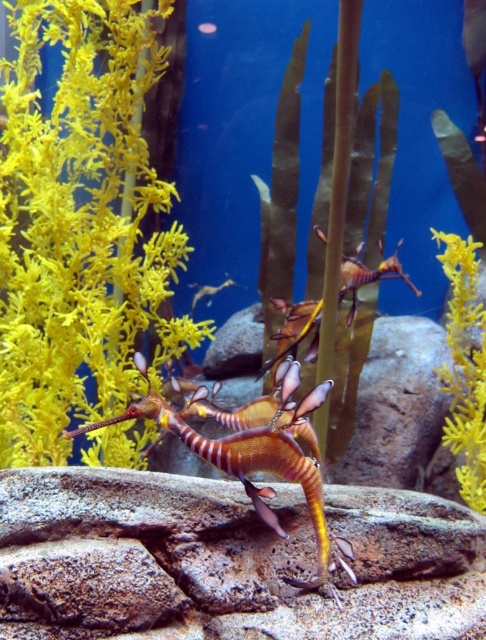
You are an underwater explorer looking at the aquarium. You see the shiny metallic seahorse at center and the yellow matte plant at left. Which object is closer to you?

The yellow matte plant at left is closer to you because the shiny metallic seahorse at center is behind it.

You are an underwater explorer with a 3.5 feet long robotic arm. You need to reach the shiny metallic seahorse at center from your current position near the yellow matte plant at left. Can your robotic arm reach it?

The yellow matte plant at left is 3.39 feet away from the shiny metallic seahorse at center. Since your robotic arm is 3.5 feet long, it can reach the shiny metallic seahorse at center from the yellow matte plant at left.